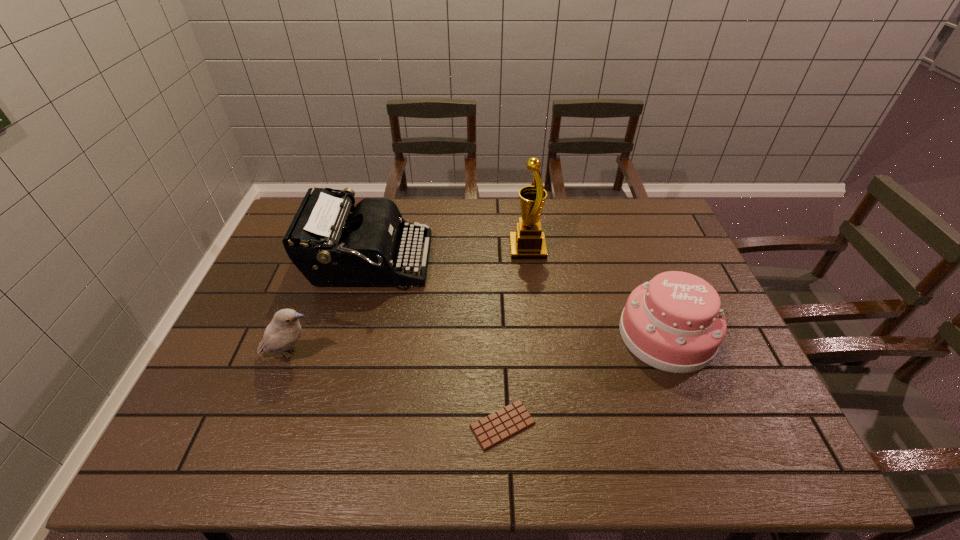
Identify the location of vacant space at the far edge of the desktop. (x=593, y=204).

Find the location of a particular element. blank space at the near edge is located at coordinates (664, 439).

This screenshot has width=960, height=540. In the image, there is a desktop. What are the coordinates of `blank space at the right edge` in the screenshot? It's located at (700, 392).

The width and height of the screenshot is (960, 540). I want to click on vacant space at the far right corner of the desktop, so click(654, 211).

This screenshot has width=960, height=540. What are the coordinates of `vacant point located between the award and the birthday cake` in the screenshot? It's located at (597, 292).

You are a GUI agent. You are given a task and a screenshot of the screen. Output one action in this format:
    pyautogui.click(x=<x>, y=<y>)
    Task: Click on the empty location between the candy bar and the rightmost object
    This screenshot has height=540, width=960.
    Given the screenshot: What is the action you would take?
    pyautogui.click(x=585, y=380)

Where is `empty space between the award and the candy bar`? The height and width of the screenshot is (540, 960). empty space between the award and the candy bar is located at coordinates (516, 337).

Identify the location of vacant point located between the bird and the candy bar. (396, 390).

Find the location of a particular element. free space that is in between the typewriter and the candy bar is located at coordinates (436, 343).

Where is `blank region between the shortest object and the bird`? This screenshot has width=960, height=540. blank region between the shortest object and the bird is located at coordinates (396, 390).